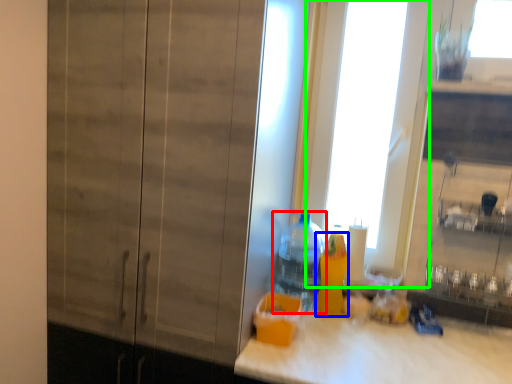
Question: Estimate the real-world distances between objects in this image. Which object is closer to bottle (highlighted by a red box), bottle (highlighted by a blue box) or glass door (highlighted by a green box)?

Choices:
 (A) bottle
 (B) glass door

Answer: (A)